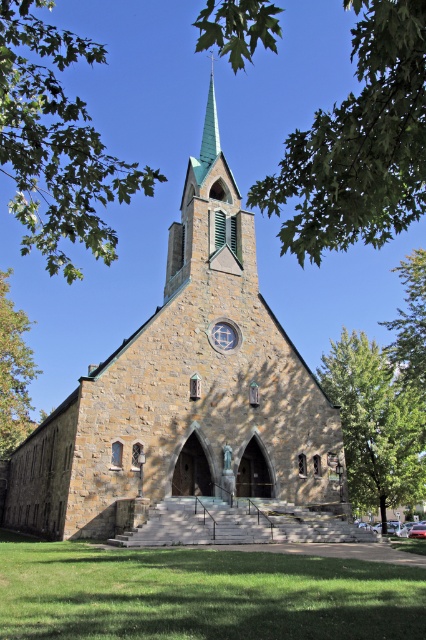
What are the coordinates of `green leafy tree at upper center` in the screenshot? It's located at (359, 144).

Who is taller, green leafy tree at upper center or green leafy tree at upper left?

Standing taller between the two is green leafy tree at upper center.

Identify the location of green leafy tree at upper center. The width and height of the screenshot is (426, 640). (359, 144).

Where is `green leafy tree at upper center`? The width and height of the screenshot is (426, 640). green leafy tree at upper center is located at coordinates (359, 144).

Who is more forward, (333, 349) or (213, 100)?

Positioned in front is point (333, 349).

Does green leafy tree at right appear on the right side of green glass spire at upper center?

Yes, green leafy tree at right is to the right of green glass spire at upper center.

Who is more distant from viewer, [383,461] or [212,88]?

The point [212,88] is behind.

The height and width of the screenshot is (640, 426). I want to click on green leafy tree at right, so click(376, 422).

Which is more to the right, green leafy tree at left or green leafy tree at upper right?

green leafy tree at upper right

Which is in front, point (11, 369) or point (423, 316)?

Point (423, 316) is more forward.

Which is in front, point (23, 404) or point (420, 316)?

Point (420, 316) is in front.

I want to click on green leafy tree at left, so click(x=14, y=372).